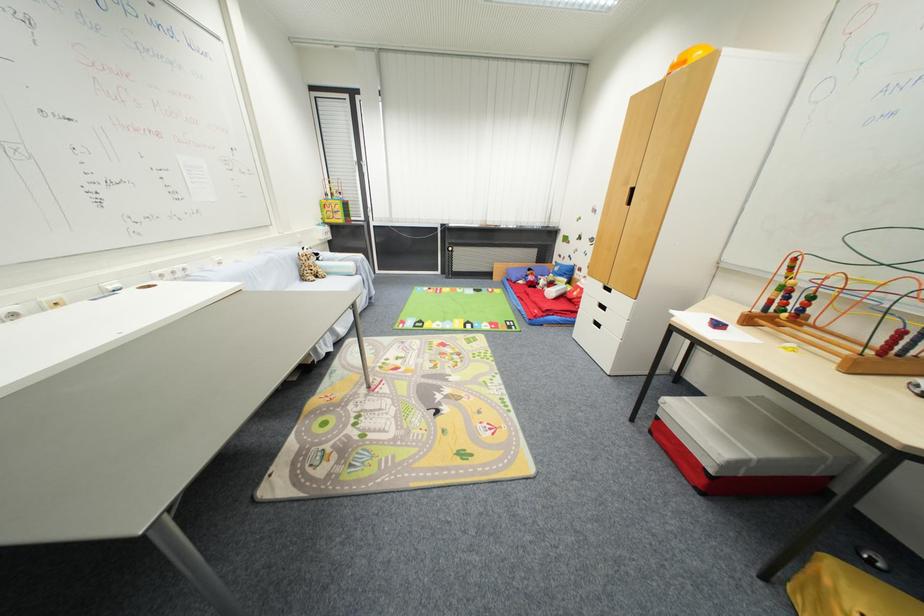
Image resolution: width=924 pixels, height=616 pixels. Identify the location of sofa sitting surface. (336, 282).